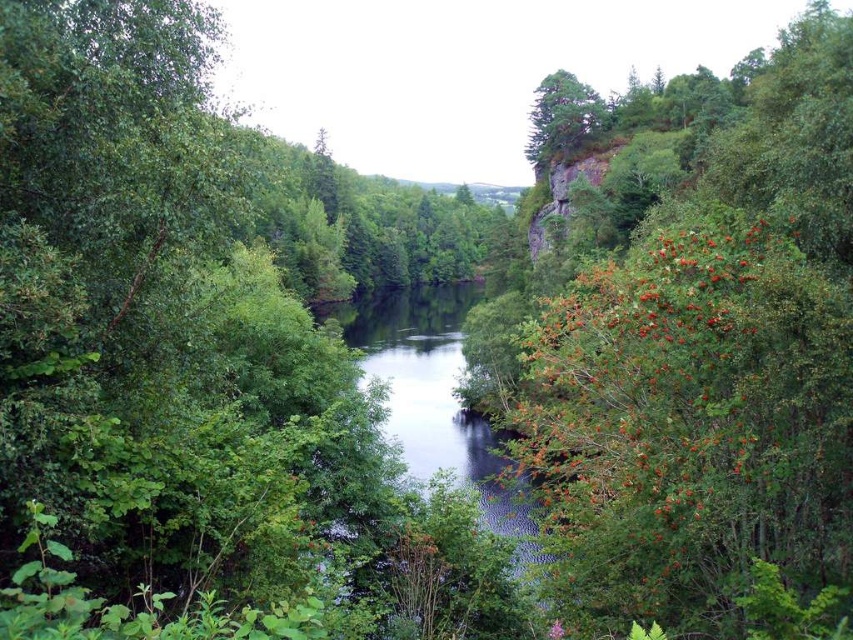
Question: Is green leafy tree at right closer to the viewer compared to green rough bark tree at upper center?

Choices:
 (A) yes
 (B) no

Answer: (A)

Question: Which of the following is the closest to the observer?

Choices:
 (A) (836, 449)
 (B) (534, 113)
 (C) (515, 486)

Answer: (A)

Question: Is green leafy tree at right smaller than green rough bark tree at upper center?

Choices:
 (A) yes
 (B) no

Answer: (B)

Question: Which of the following is the farthest from the observer?

Choices:
 (A) (701, 515)
 (B) (563, 156)
 (C) (355, 310)

Answer: (C)

Question: Which point is closer to the camera?

Choices:
 (A) (428, 445)
 (B) (662, 289)

Answer: (B)

Question: Is clear water at center thinner than green rough bark tree at upper center?

Choices:
 (A) no
 (B) yes

Answer: (A)